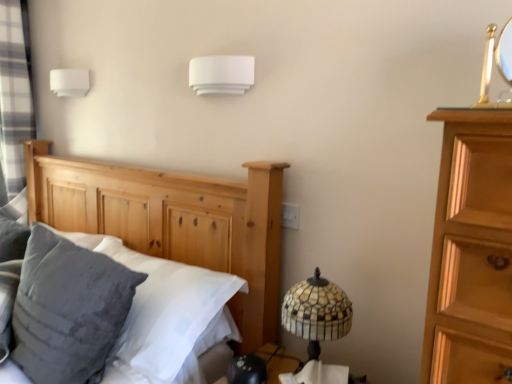
This screenshot has width=512, height=384. What do you see at coordinates (15, 93) in the screenshot? I see `gray plaid curtain at left` at bounding box center [15, 93].

The image size is (512, 384). Identify the location of velvety gray pillow at left. (68, 309).

Where is `white matte wall light at upper center, the 2th lamp in the left-to-right sequence`? The width and height of the screenshot is (512, 384). white matte wall light at upper center, the 2th lamp in the left-to-right sequence is located at coordinates (221, 74).

Identify the location of natural wood bed at left. Image resolution: width=512 pixels, height=384 pixels. (174, 221).

What do you see at coordinates (174, 221) in the screenshot? I see `natural wood bed at left` at bounding box center [174, 221].

What is the approximate height of mosaic glass lampshade at lower right?

mosaic glass lampshade at lower right is 12.51 inches tall.

The height and width of the screenshot is (384, 512). What are the coordinates of `mosaic glass lampshade at lower right` in the screenshot? It's located at (316, 312).

At what (x,y) coordinates should I click in order to perform the action: click on gray plaid curtain at left. Please return your answer as a coordinate pair (x, y). The image size is (512, 384). Looking at the image, I should click on (15, 93).

Is gray plaid curtain at left to the left or to the right of white plastic electric outlet at center in the image?

From the image, it's evident that gray plaid curtain at left is to the left of white plastic electric outlet at center.

From the image's perspective, is gray plaid curtain at left over white plastic electric outlet at center?

Correct, gray plaid curtain at left appears higher than white plastic electric outlet at center in the image.

In the scene shown: Can white plastic electric outlet at center be found inside gray plaid curtain at left?

No, white plastic electric outlet at center is not surrounded by gray plaid curtain at left.

Does white matte rectangular object at upper left, marked as the 2th lamp in a right-to-left arrangement, have a greater width compared to mosaic glass lampshade at lower right?

Incorrect, the width of white matte rectangular object at upper left, marked as the 2th lamp in a right-to-left arrangement, does not surpass that of mosaic glass lampshade at lower right.

From the image's perspective, is white matte rectangular object at upper left, the 1th lamp when ordered from left to right, below mosaic glass lampshade at lower right?

No, from the image's perspective, white matte rectangular object at upper left, the 1th lamp when ordered from left to right, is not below mosaic glass lampshade at lower right.

Does white matte rectangular object at upper left, acting as the 1th lamp starting from the back, have a smaller size compared to mosaic glass lampshade at lower right?

Indeed, white matte rectangular object at upper left, acting as the 1th lamp starting from the back, has a smaller size compared to mosaic glass lampshade at lower right.

From the image's perspective, which one is positioned lower, white matte wall light at upper center, which ranks as the 1th lamp in right-to-left order, or gray plaid curtain at left?

white matte wall light at upper center, which ranks as the 1th lamp in right-to-left order.

Is white matte wall light at upper center, arranged as the 1th lamp when viewed from the front, behind gray plaid curtain at left?

No, white matte wall light at upper center, arranged as the 1th lamp when viewed from the front, is in front of gray plaid curtain at left.

Between point (248, 74) and point (2, 93), which one is positioned behind?

Positioned behind is point (2, 93).

Is white matte rectangular object at upper left, arranged as the second lamp when viewed from the front, spatially inside velvety gray pillow at left, or outside of it?

white matte rectangular object at upper left, arranged as the second lamp when viewed from the front, is not enclosed by velvety gray pillow at left.

Is white matte rectangular object at upper left, acting as the 1th lamp starting from the back, bigger or smaller than velvety gray pillow at left?

white matte rectangular object at upper left, acting as the 1th lamp starting from the back, is smaller than velvety gray pillow at left.

Is white matte rectangular object at upper left, arranged as the second lamp when viewed from the front, turned away from velvety gray pillow at left?

white matte rectangular object at upper left, arranged as the second lamp when viewed from the front, is not turned away from velvety gray pillow at left.

You are a GUI agent. You are given a task and a screenshot of the screen. Output one action in this format:
    pyautogui.click(x=<x>, y=<y>)
    Task: Click on the pillow on the left of white matte wall light at upper center, which appears as the second lamp when viewed from the back
    The width and height of the screenshot is (512, 384).
    Given the screenshot: What is the action you would take?
    pyautogui.click(x=68, y=309)

Does velvety gray pillow at left have a lesser width compared to white matte wall light at upper center, which appears as the second lamp when viewed from the back?

In fact, velvety gray pillow at left might be wider than white matte wall light at upper center, which appears as the second lamp when viewed from the back.

Is velvety gray pillow at left behind white matte wall light at upper center, the 2th lamp in the left-to-right sequence?

No, velvety gray pillow at left is closer to the viewer.

Between point (80, 246) and point (214, 92), which one is positioned behind?

The point (80, 246) is more distant.

Is mosaic glass lampshade at lower right wider than velvety gray pillow at left?

In fact, mosaic glass lampshade at lower right might be narrower than velvety gray pillow at left.

Does point (339, 335) appear closer or farther from the camera than point (114, 307)?

Point (339, 335) appears to be closer to the viewer than point (114, 307).

Does mosaic glass lampshade at lower right appear on the right side of velvety gray pillow at left?

Yes.

Would you say velvety gray pillow at left is part of mosaic glass lampshade at lower right's contents?

That's incorrect, velvety gray pillow at left is not inside mosaic glass lampshade at lower right.

From the image's perspective, does white plastic electric outlet at center appear higher than natural wood bed at left?

Yes.

Considering the positions of point (292, 225) and point (162, 225), is point (292, 225) closer or farther from the camera than point (162, 225)?

Point (292, 225) is closer to the camera than point (162, 225).

Consider the image. From a real-world perspective, does white plastic electric outlet at center sit lower than natural wood bed at left?

No, from a real-world perspective, white plastic electric outlet at center is not below natural wood bed at left.

Is natural wood bed at left at the back of white plastic electric outlet at center?

No, white plastic electric outlet at center is not facing away from natural wood bed at left.

The image size is (512, 384). Find the location of `curtain that is above the white plastic electric outlet at center (from a real-world perspective)`. curtain that is above the white plastic electric outlet at center (from a real-world perspective) is located at coordinates (15, 93).

Locate an element on the screen. The width and height of the screenshot is (512, 384). bedside lamp below the white matte rectangular object at upper left, acting as the 1th lamp starting from the back (from a real-world perspective) is located at coordinates (316, 312).

From the picture: From the image, which object appears to be farther from white plastic electric outlet at center, velvety gray pillow at left or mosaic glass lampshade at lower right?

velvety gray pillow at left lies further to white plastic electric outlet at center than the other object.

Based on their spatial positions, is white plastic electric outlet at center or white matte rectangular object at upper left, marked as the 2th lamp in a right-to-left arrangement, further from natural wood bed at left?

white matte rectangular object at upper left, marked as the 2th lamp in a right-to-left arrangement, lies further to natural wood bed at left than the other object.

Which object lies further to the anchor point mosaic glass lampshade at lower right, white plastic electric outlet at center or velvety gray pillow at left?

Among the two, velvety gray pillow at left is located further to mosaic glass lampshade at lower right.

When comparing their distances from natural wood bed at left, does white matte rectangular object at upper left, arranged as the second lamp when viewed from the front, or white plastic electric outlet at center seem further?

white matte rectangular object at upper left, arranged as the second lamp when viewed from the front, is positioned further to the anchor natural wood bed at left.

Which object lies further to the anchor point white plastic electric outlet at center, mosaic glass lampshade at lower right or velvety gray pillow at left?

Based on the image, velvety gray pillow at left appears to be further to white plastic electric outlet at center.

Estimate the real-world distances between objects in this image. Which object is further from velvety gray pillow at left, white plastic electric outlet at center or gray plaid curtain at left?

The object further to velvety gray pillow at left is gray plaid curtain at left.

In the scene shown: When comparing their distances from gray plaid curtain at left, does natural wood bed at left or velvety gray pillow at left seem further?

Based on the image, velvety gray pillow at left appears to be further to gray plaid curtain at left.

From the image, which object appears to be farther from mosaic glass lampshade at lower right, white matte wall light at upper center, which ranks as the 1th lamp in right-to-left order, or velvety gray pillow at left?

Based on the image, white matte wall light at upper center, which ranks as the 1th lamp in right-to-left order, appears to be further to mosaic glass lampshade at lower right.

Find the location of a particular element. This screenshot has height=384, width=512. bedside lamp between natural wood bed at left and white matte rectangular object at upper left, acting as the 1th lamp starting from the back, in the front-back direction is located at coordinates (316, 312).

You are a GUI agent. You are given a task and a screenshot of the screen. Output one action in this format:
    pyautogui.click(x=<x>, y=<y>)
    Task: Click on the pillow between white matte wall light at upper center, which appears as the second lamp when viewed from the back, and mosaic glass lampshade at lower right in the up-down direction
    Image resolution: width=512 pixels, height=384 pixels.
    Given the screenshot: What is the action you would take?
    pyautogui.click(x=68, y=309)

Locate an element on the screen. Image resolution: width=512 pixels, height=384 pixels. electric outlet between gray plaid curtain at left and mosaic glass lampshade at lower right is located at coordinates (290, 216).

Find the location of a particular element. The image size is (512, 384). lamp between white matte rectangular object at upper left, the 1th lamp when ordered from left to right, and white plastic electric outlet at center from left to right is located at coordinates (221, 74).